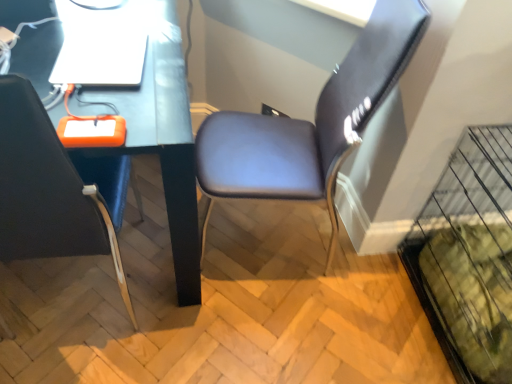
This screenshot has width=512, height=384. In order to click on vacant space underneath suede-like brown chair at center-right, which is counted as the 1th chair, starting from the right (from a real-world perspective) in this screenshot , I will do `click(264, 244)`.